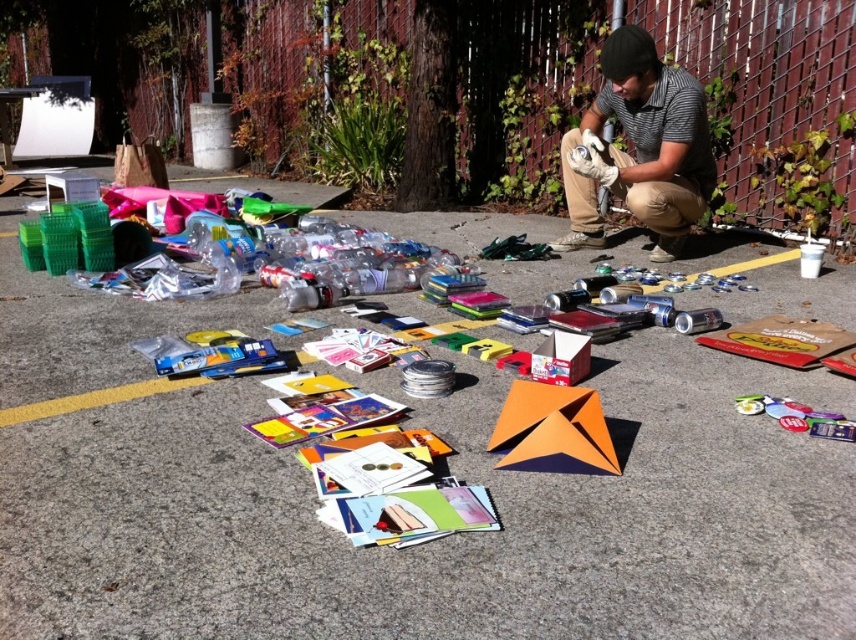
Question: Can you confirm if orange paper airplane at center is positioned above gray striped shirt at center?

Choices:
 (A) no
 (B) yes

Answer: (A)

Question: From the image, what is the correct spatial relationship of orange paper airplane at center in relation to gray striped shirt at center?

Choices:
 (A) below
 (B) above

Answer: (A)

Question: Among these objects, which one is farthest from the camera?

Choices:
 (A) gray striped shirt at center
 (B) orange paper airplane at center

Answer: (A)

Question: Which point is farther to the camera?

Choices:
 (A) orange paper airplane at center
 (B) gray striped shirt at center

Answer: (B)

Question: Which point is farther from the camera taking this photo?

Choices:
 (A) (673, 211)
 (B) (9, 422)

Answer: (A)

Question: Is orange paper airplane at center wider than gray striped shirt at center?

Choices:
 (A) no
 (B) yes

Answer: (B)